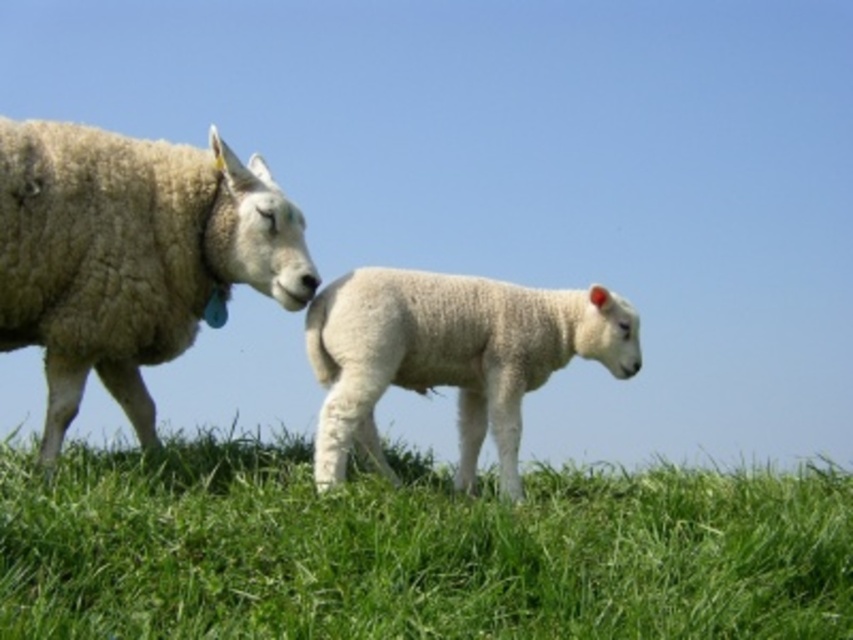
Does green grassy at lower center come behind white woolen sheep at left?

No, it is not.

From the picture: Between green grassy at lower center and white woolen sheep at left, which one has more height?

white woolen sheep at left

Find the location of a particular element. This screenshot has width=853, height=640. green grassy at lower center is located at coordinates (412, 548).

Between white woolen sheep at left and white woolen lamb at center, which one is positioned higher?

white woolen sheep at left is above.

The image size is (853, 640). What do you see at coordinates (129, 253) in the screenshot?
I see `white woolen sheep at left` at bounding box center [129, 253].

The height and width of the screenshot is (640, 853). In order to click on white woolen sheep at left in this screenshot , I will do `click(129, 253)`.

Which is behind, point (140, 477) or point (483, 420)?

Positioned behind is point (483, 420).

Does green grassy at lower center have a greater height compared to white woolen lamb at center?

In fact, green grassy at lower center may be shorter than white woolen lamb at center.

Is point (349, 616) positioned in front of point (462, 449)?

Yes.

What are the coordinates of `green grassy at lower center` in the screenshot? It's located at (412, 548).